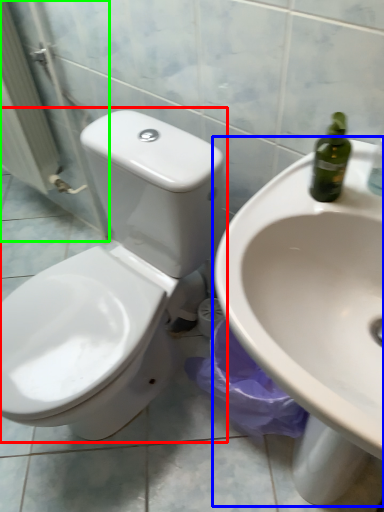
Question: Based on their relative distances, which object is nearer to toilet (highlighted by a red box)? Choose from sink (highlighted by a blue box) and screen door (highlighted by a green box).

Choices:
 (A) sink
 (B) screen door

Answer: (A)